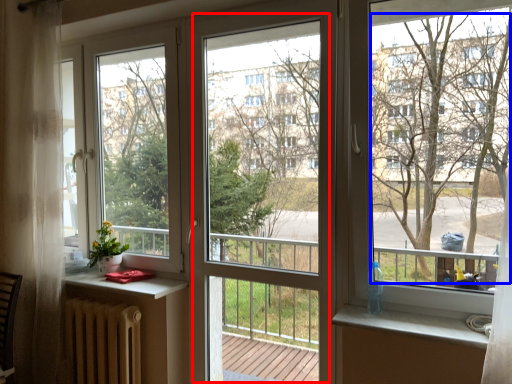
Question: Which object appears farthest to the camera in this image, screen door (highlighted by a red box) or tree (highlighted by a blue box)?

Choices:
 (A) screen door
 (B) tree

Answer: (A)